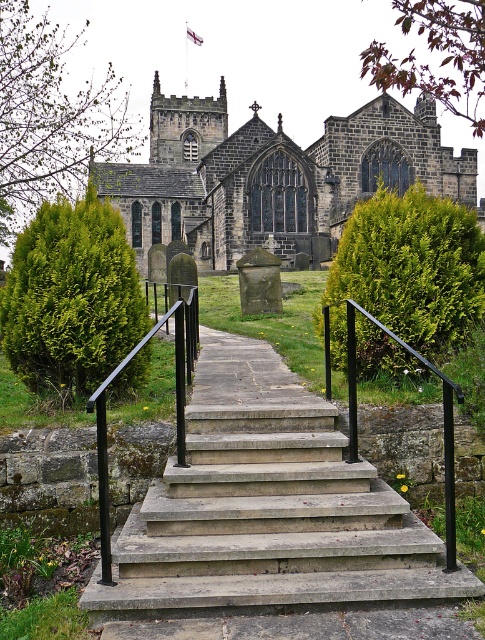
Question: Does concrete steps at center appear on the right side of black metal/rail at center?

Choices:
 (A) yes
 (B) no

Answer: (B)

Question: Estimate the real-world distances between objects in this image. Which object is farther from the concrete steps at center?

Choices:
 (A) black metal handrail at center
 (B) dark gray stone church at center

Answer: (B)

Question: Which object appears farthest from the camera in this image?

Choices:
 (A) black metal/rail at center
 (B) concrete steps at center
 (C) dark gray stone church at center

Answer: (C)

Question: Is concrete steps at center positioned at the back of black metal/rail at center?

Choices:
 (A) no
 (B) yes

Answer: (A)

Question: From the image, what is the correct spatial relationship of dark gray stone church at center in relation to black metal handrail at center?

Choices:
 (A) below
 (B) above

Answer: (B)

Question: Which point is farther to the camera?

Choices:
 (A) dark gray stone church at center
 (B) concrete steps at center
 (C) black metal/rail at center
 (D) black metal handrail at center

Answer: (A)